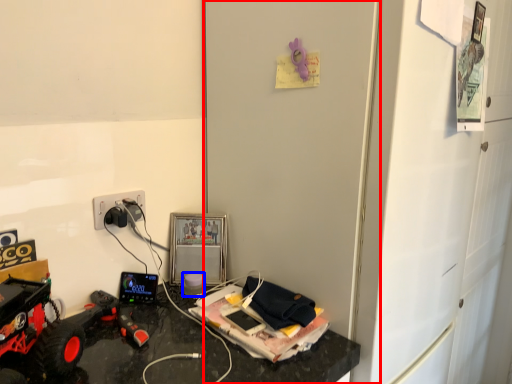
Question: Which object appears farthest to the camera in this image, door (highlighted by a red box) or toy (highlighted by a blue box)?

Choices:
 (A) door
 (B) toy

Answer: (B)